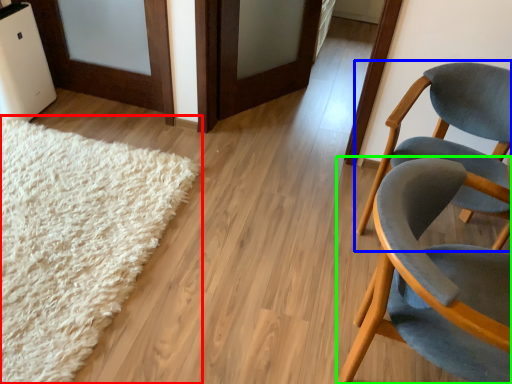
Question: Based on their relative distances, which object is nearer to mat (highlighted by a red box)? Choose from chair (highlighted by a blue box) and chair (highlighted by a green box).

Choices:
 (A) chair
 (B) chair

Answer: (B)